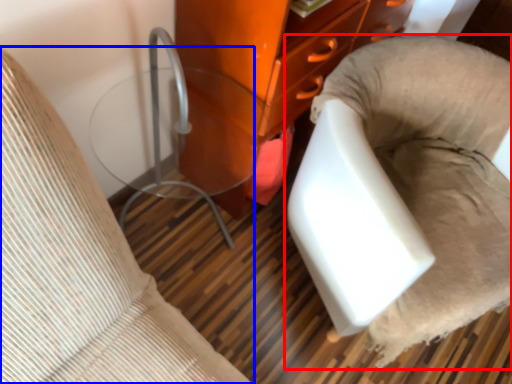
Question: Among these objects, which one is nearest to the camera, furniture (highlighted by a red box) or furniture (highlighted by a blue box)?

Choices:
 (A) furniture
 (B) furniture

Answer: (B)